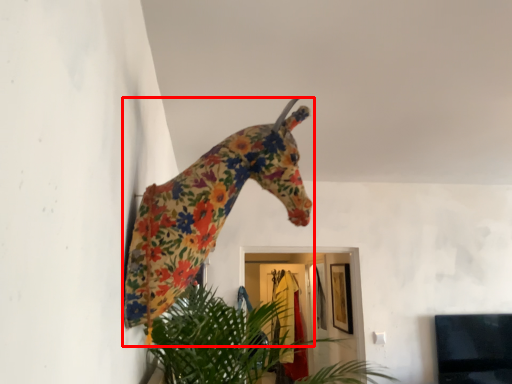
Question: From the image's perspective, considering the relative positions of giraffe (annotated by the red box) and houseplant in the image provided, where is giraffe (annotated by the red box) located with respect to the staircase?

Choices:
 (A) below
 (B) above

Answer: (B)